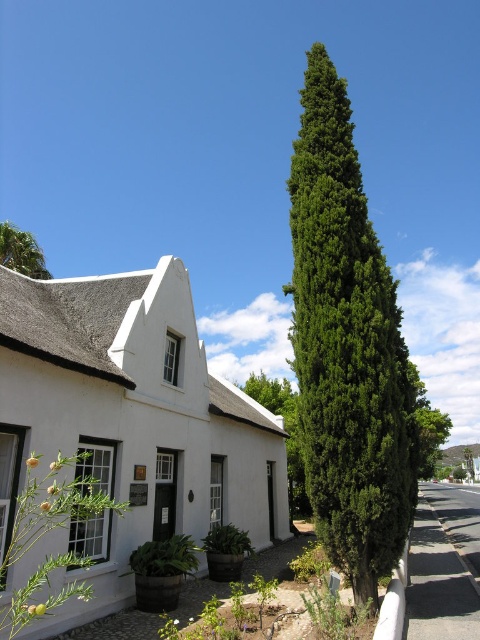
Which of these two, green leafy plant at lower left or green leafy tree at upper left, stands shorter?

Standing shorter between the two is green leafy plant at lower left.

Does point (184, 566) come in front of point (41, 260)?

Yes, point (184, 566) is in front of point (41, 260).

Who is more forward, (152, 548) or (26, 266)?

Point (152, 548) is more forward.

Image resolution: width=480 pixels, height=640 pixels. I want to click on green leafy plant at lower left, so click(x=165, y=557).

Who is lower down, green needle-like foliage at center or green leafy bush at center?

green leafy bush at center is lower down.

Between green needle-like foliage at center and green leafy bush at center, which one appears on the right side from the viewer's perspective?

green needle-like foliage at center is more to the right.

I want to click on green needle-like foliage at center, so (348, 348).

Is point (32, 250) closer to viewer compared to point (292, 566)?

That is False.

The height and width of the screenshot is (640, 480). Find the location of `green leafy tree at upper left`. green leafy tree at upper left is located at coordinates (22, 252).

Between point (36, 269) and point (304, 550), which one is positioned behind?

The point (36, 269) is more distant.

Identify the location of green leafy tree at upper left. (22, 252).